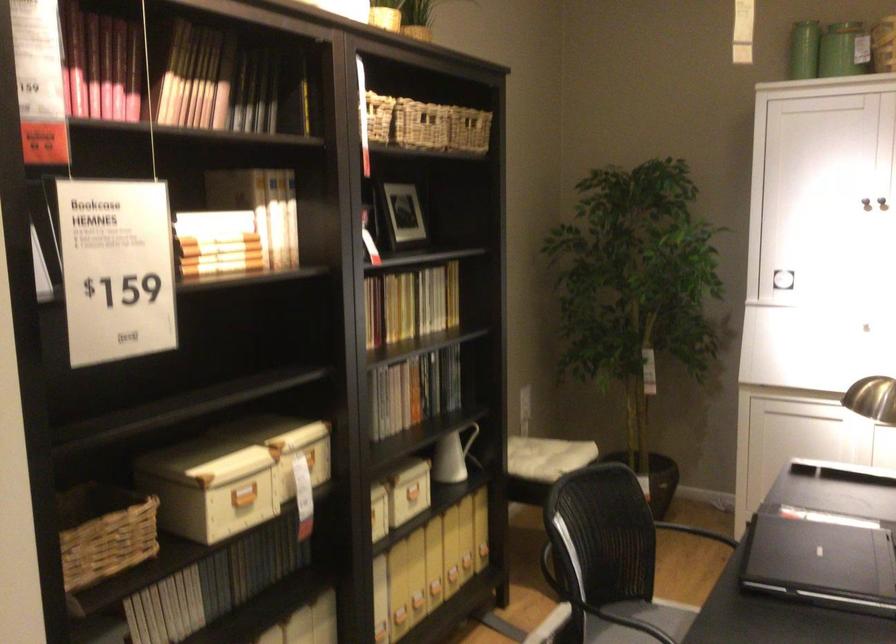
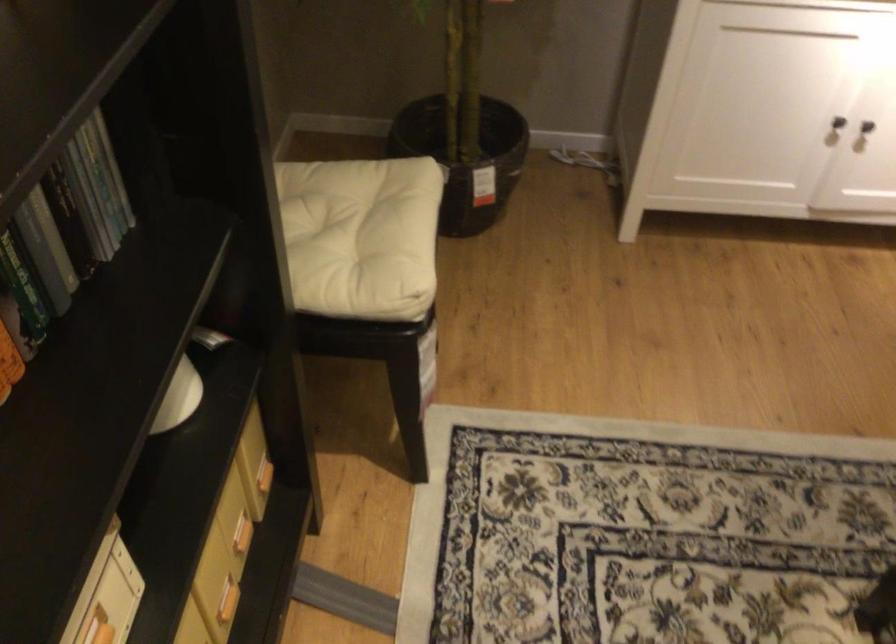
Where in the second image is the point corresponding to [432,395] from the first image?

(53, 238)